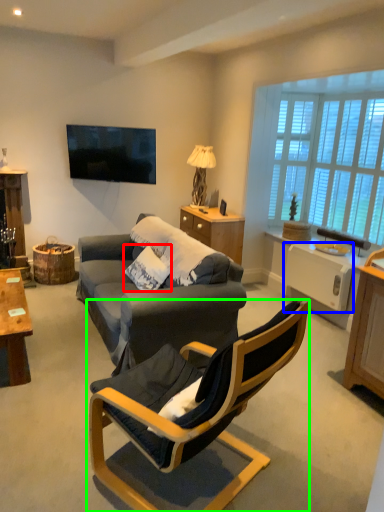
Question: Which object is the farthest from pillow (highlighted by a red box)? Choose among these: appliance (highlighted by a blue box) or chair (highlighted by a green box).

Choices:
 (A) appliance
 (B) chair

Answer: (A)